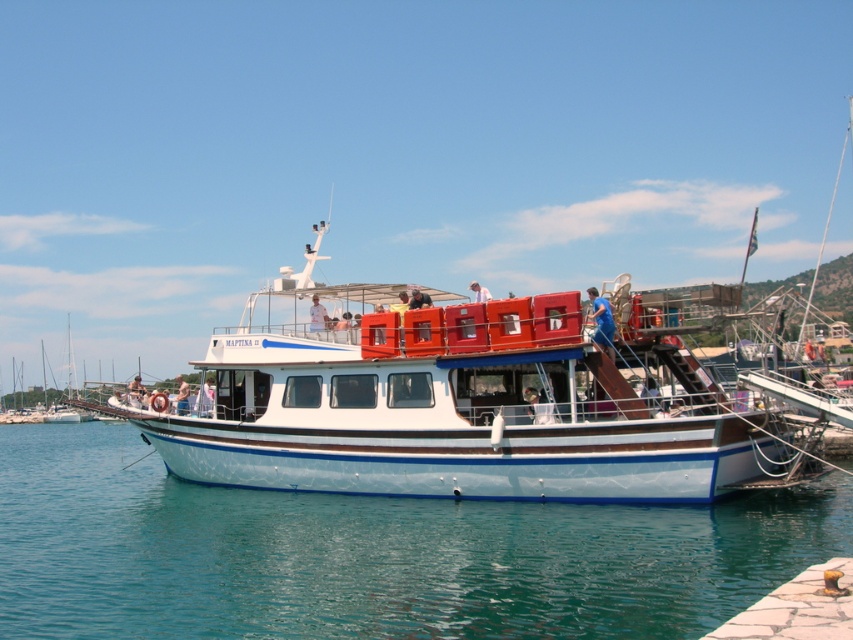
Which is more to the left, white polished wood boat at center or matte orange life preserver at upper center?

Positioned to the left is matte orange life preserver at upper center.

Is white polished wood boat at center shorter than matte orange life preserver at upper center?

No.

Does point (375, 472) come farther from viewer compared to point (421, 298)?

That is False.

At what (x,y) coordinates should I click in order to perform the action: click on white polished wood boat at center. Please return your answer as a coordinate pair (x, y). The image size is (853, 640). Looking at the image, I should click on (477, 403).

Does blue fabric shirt at upper center have a lesser width compared to matte orange life preserver at upper center?

In fact, blue fabric shirt at upper center might be wider than matte orange life preserver at upper center.

This screenshot has height=640, width=853. What do you see at coordinates (601, 321) in the screenshot?
I see `blue fabric shirt at upper center` at bounding box center [601, 321].

Where is `blue fabric shirt at upper center`? blue fabric shirt at upper center is located at coordinates (601, 321).

Find the location of a particular element. The image size is (853, 640). blue fabric shirt at upper center is located at coordinates (601, 321).

Is matte orange life preserver at upper center to the left of light blue fabric shirt at upper center from the viewer's perspective?

Indeed, matte orange life preserver at upper center is positioned on the left side of light blue fabric shirt at upper center.

Does matte orange life preserver at upper center have a larger size compared to light blue fabric shirt at upper center?

No.

Does point (425, 298) come behind point (485, 298)?

Yes, it is.

The image size is (853, 640). Find the location of `matte orange life preserver at upper center`. matte orange life preserver at upper center is located at coordinates (419, 300).